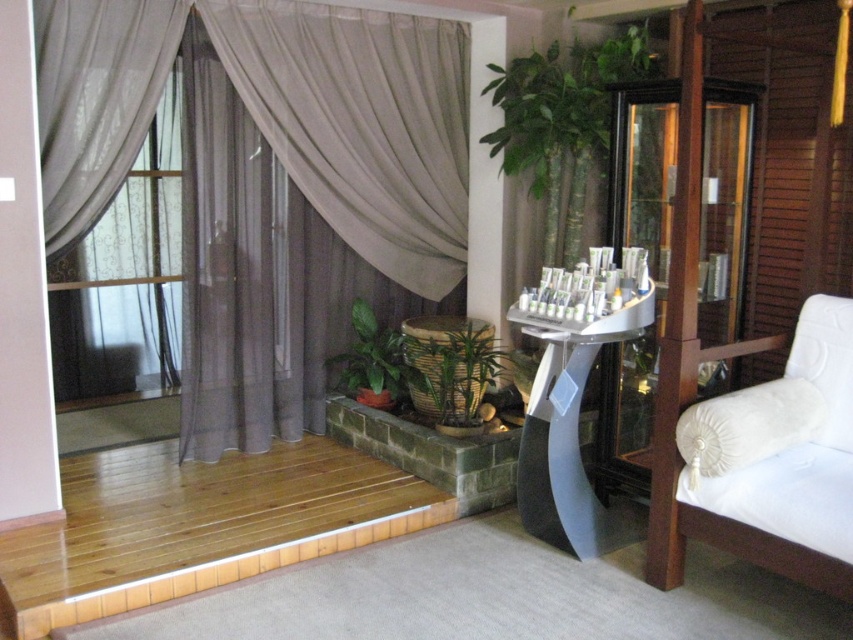
You are a guest in this spa room and want to sit in the white fabric armchair at right. To do so, you need to walk around the sheer gray curtain at left. Is the curtain on the left side of the armchair?

The sheer gray curtain at left is positioned on the left side of the white fabric armchair at right, so yes, the curtain is on the left side of the armchair.

You are sitting in the white fabric armchair at right and want to look at the sheer gray curtain at left. Which direction should you turn your head to see it?

You should turn your head to the left to see the sheer gray curtain at left because it is positioned to the left side of the white fabric armchair at right.

You are standing at the entrance of the spa area and notice a metallic gray table at center. If you want to place a tray of skincare products on this table, where exactly should you aim to place it?

The metallic gray table at center is located at point (567, 429), so you should aim for that coordinate to place the tray of skincare products accurately.